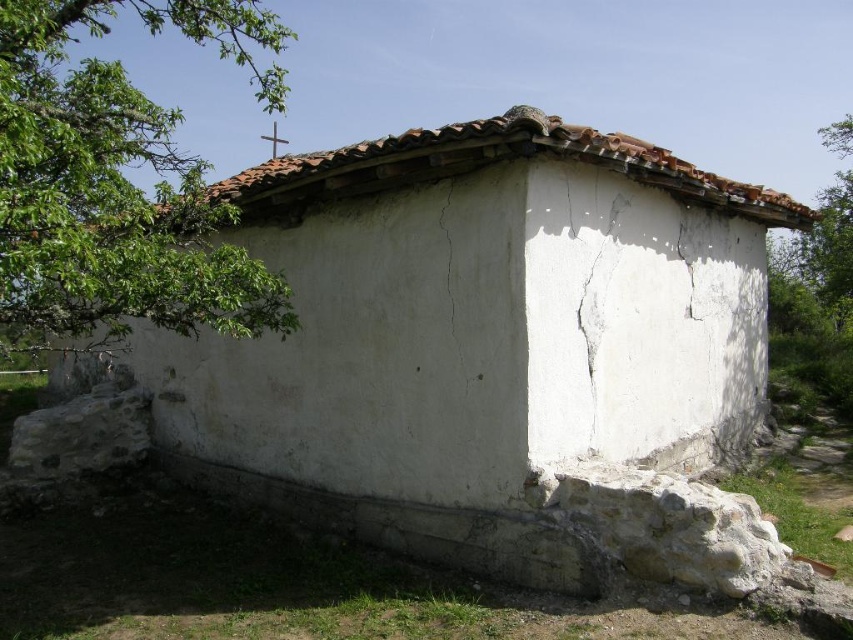
You are standing in front of the rustic building and notice two features at the upper center area. Which one is closer to you, the brown tile roof at upper center or the white plaster crack at upper center?

The brown tile roof at upper center is closer to the viewer than the white plaster crack at upper center.

You are standing in front of the rustic building and want to determine the position of two points marked on the structure. Which of the two points, point (x=460, y=344) or point (x=846, y=321), is closer to you?

Point (x=460, y=344) is closer to the viewer than point (x=846, y=321).